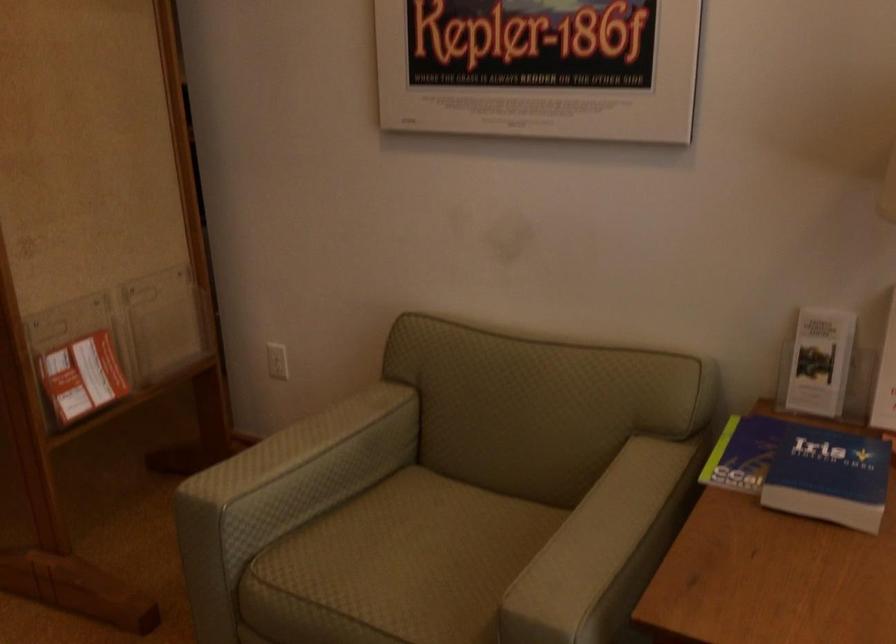
You are a GUI agent. You are given a task and a screenshot of the screen. Output one action in this format:
    pyautogui.click(x=<x>, y=<y>)
    Task: Click on the chair sitting surface
    
    Given the screenshot: What is the action you would take?
    pyautogui.click(x=407, y=563)